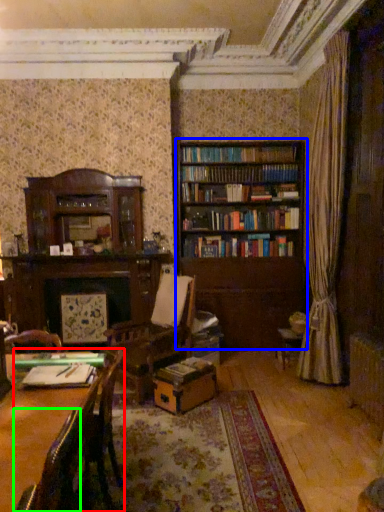
Question: Estimate the real-world distances between objects in this image. Which object is closer to chair (highlighted by a red box), bookcase (highlighted by a blue box) or chair (highlighted by a green box)?

Choices:
 (A) bookcase
 (B) chair

Answer: (B)